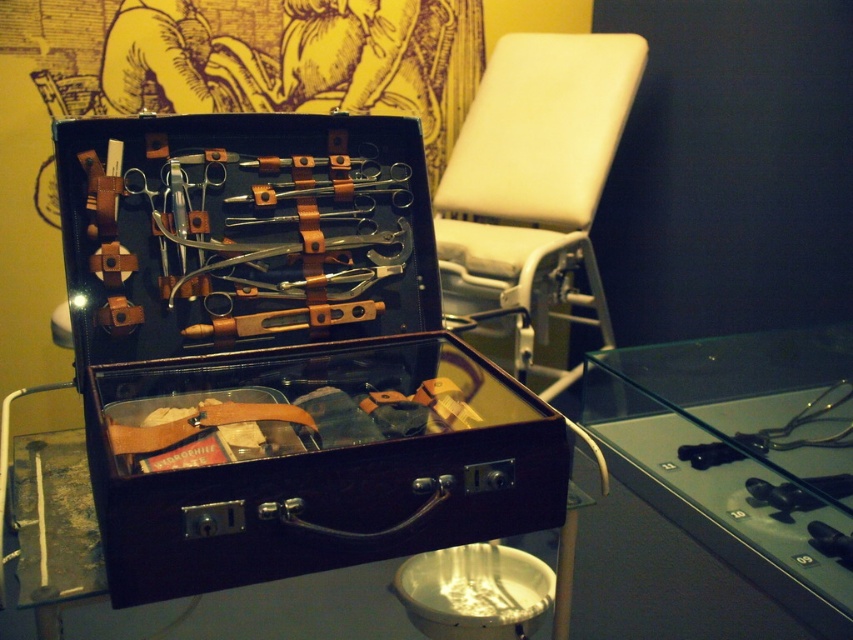
Is leather suitcase at center in front of transparent glass case at center?

Yes, it is.

Based on the photo, which is more to the right, leather suitcase at center or transparent glass case at center?

From the viewer's perspective, transparent glass case at center appears more on the right side.

Does point (305, 115) come behind point (585, 413)?

No, it is in front of (585, 413).

Locate an element on the screen. This screenshot has height=640, width=853. leather suitcase at center is located at coordinates (281, 353).

Between transparent glass case at center and polished silver scissors at center, which one is positioned higher?

polished silver scissors at center is higher up.

Between transparent glass case at center and polished silver scissors at center, which one is positioned lower?

Positioned lower is transparent glass case at center.

Which is in front, point (838, 480) or point (341, 132)?

Point (838, 480) is more forward.

At what (x,y) coordinates should I click in order to perform the action: click on transparent glass case at center. Please return your answer as a coordinate pair (x, y). Image resolution: width=853 pixels, height=640 pixels. Looking at the image, I should click on (741, 456).

Is point (717, 465) more distant than point (758, 477)?

Yes, it is behind point (758, 477).

Is point (821, 417) closer to camera compared to point (770, 486)?

No, it is behind (770, 486).

Who is more forward, (724, 456) or (805, 502)?

Positioned in front is point (805, 502).

This screenshot has width=853, height=640. Identify the location of metallic silver scissors at center. (802, 424).